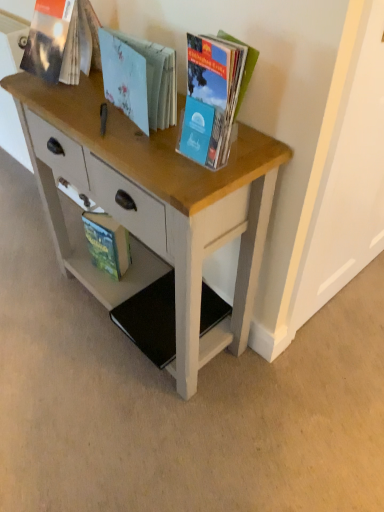
Question: Is wooden desk at center looking in the opposite direction of matte plastic book at upper right, the first book in the front-to-back sequence?

Choices:
 (A) yes
 (B) no

Answer: (B)

Question: Does wooden desk at center lie in front of matte plastic book at upper right, the fourth book from the back?

Choices:
 (A) yes
 (B) no

Answer: (B)

Question: From a real-world perspective, is wooden desk at center below matte plastic book at upper right, the first book in the front-to-back sequence?

Choices:
 (A) no
 (B) yes

Answer: (B)

Question: Considering the relative positions of wooden desk at center and matte plastic book at upper right, the fourth book from the back, in the image provided, is wooden desk at center to the right of matte plastic book at upper right, the fourth book from the back, from the viewer's perspective?

Choices:
 (A) no
 (B) yes

Answer: (A)

Question: From the image's perspective, is wooden desk at center over matte plastic book at upper right, the fourth book from the back?

Choices:
 (A) yes
 (B) no

Answer: (B)

Question: Is point (243, 310) positioned closer to the camera than point (84, 236)?

Choices:
 (A) closer
 (B) farther

Answer: (A)

Question: Based on their sizes in the image, would you say wooden desk at center is bigger or smaller than green matte book at lower left, the 4th book in the front-to-back sequence?

Choices:
 (A) big
 (B) small

Answer: (A)

Question: Is wooden desk at center spatially inside green matte book at lower left, placed as the 1th book when sorted from back to front, or outside of it?

Choices:
 (A) outside
 (B) inside

Answer: (A)

Question: In terms of height, does wooden desk at center look taller or shorter compared to green matte book at lower left, the 4th book in the front-to-back sequence?

Choices:
 (A) tall
 (B) short

Answer: (A)

Question: From a real-world perspective, is light blue paper book at center, the 2th book when ordered from front to back, physically located above or below matte paper book at upper left, marked as the third book in a front-to-back arrangement?

Choices:
 (A) above
 (B) below

Answer: (B)

Question: From the image's perspective, relative to matte paper book at upper left, positioned as the second book in back-to-front order, is light blue paper book at center, the 2th book when ordered from front to back, above or below?

Choices:
 (A) above
 (B) below

Answer: (B)

Question: Is light blue paper book at center, which ranks as the third book in back-to-front order, spatially inside matte paper book at upper left, marked as the third book in a front-to-back arrangement, or outside of it?

Choices:
 (A) outside
 (B) inside

Answer: (A)

Question: Considering the positions of light blue paper book at center, which ranks as the third book in back-to-front order, and matte paper book at upper left, positioned as the second book in back-to-front order, in the image, is light blue paper book at center, which ranks as the third book in back-to-front order, taller or shorter than matte paper book at upper left, positioned as the second book in back-to-front order,?

Choices:
 (A) tall
 (B) short

Answer: (B)

Question: Looking at their shapes, would you say wooden desk at center is wider or thinner than matte plastic book at upper right, the first book in the front-to-back sequence?

Choices:
 (A) thin
 (B) wide

Answer: (B)

Question: Relative to matte plastic book at upper right, the first book in the front-to-back sequence, is wooden desk at center in front or behind?

Choices:
 (A) behind
 (B) front

Answer: (A)